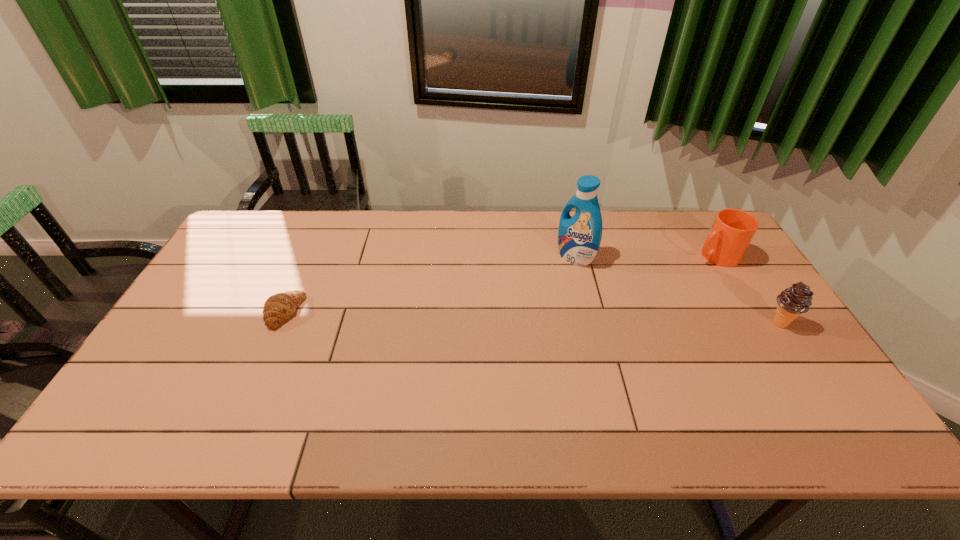
Find the location of a particular element. This screenshot has width=960, height=540. vacant point located on the front-facing side of the tallest object is located at coordinates (525, 293).

Image resolution: width=960 pixels, height=540 pixels. Find the location of `vacant region located on the handle side of the mug`. vacant region located on the handle side of the mug is located at coordinates (668, 275).

This screenshot has width=960, height=540. I want to click on free space located 0.260m on the handle side of the mug, so coord(637,291).

Locate an element on the screen. The image size is (960, 540). free space located on the handle side of the mug is located at coordinates (675, 272).

You are a GUI agent. You are given a task and a screenshot of the screen. Output one action in this format:
    pyautogui.click(x=<x>, y=<y>)
    Task: Click on the detergent that is at the far edge
    The width and height of the screenshot is (960, 540).
    Given the screenshot: What is the action you would take?
    pyautogui.click(x=579, y=237)

The image size is (960, 540). What are the coordinates of `mug present at the far edge` in the screenshot? It's located at (732, 231).

Find the location of `icecream situated at the right edge`. icecream situated at the right edge is located at coordinates (792, 302).

Find the location of `mug that is at the right edge`. mug that is at the right edge is located at coordinates (732, 231).

Where is `object at the far right corner`? The width and height of the screenshot is (960, 540). object at the far right corner is located at coordinates (732, 231).

Where is `vacant space at the far edge of the desktop`? This screenshot has width=960, height=540. vacant space at the far edge of the desktop is located at coordinates (602, 239).